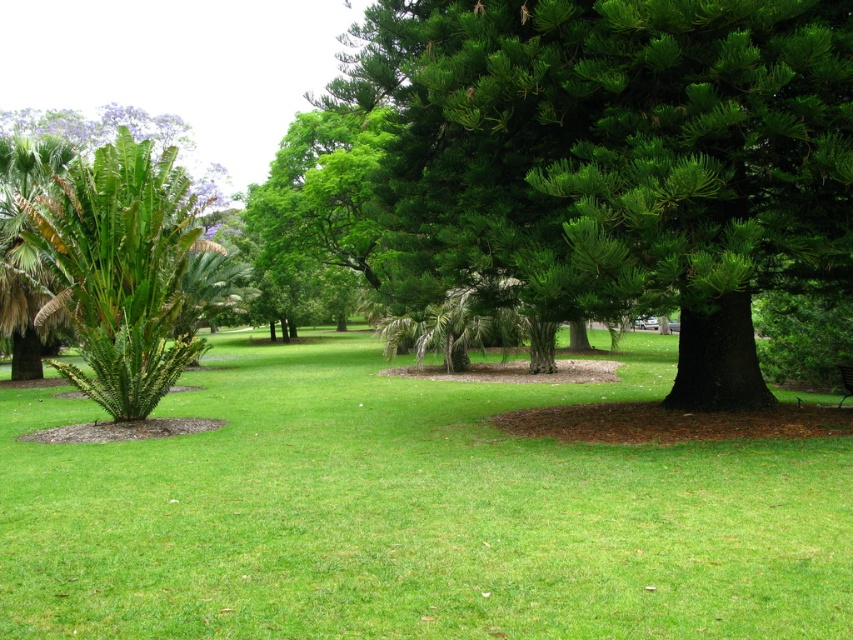
Does green grassy at center have a lesser height compared to green leafy palm tree at left?

Correct, green grassy at center is not as tall as green leafy palm tree at left.

Is green grassy at center smaller than green leafy palm tree at left?

Indeed, green grassy at center has a smaller size compared to green leafy palm tree at left.

Which is in front, point (296, 572) or point (164, 337)?

Positioned in front is point (296, 572).

This screenshot has height=640, width=853. I want to click on green grassy at center, so click(412, 513).